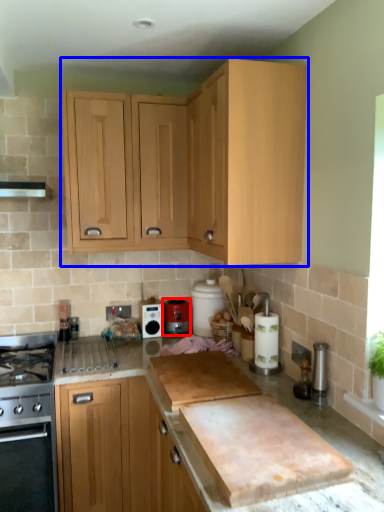
Question: Which point is further to the camera, kitchen appliance (highlighted by a red box) or cabinetry (highlighted by a blue box)?

Choices:
 (A) kitchen appliance
 (B) cabinetry

Answer: (A)